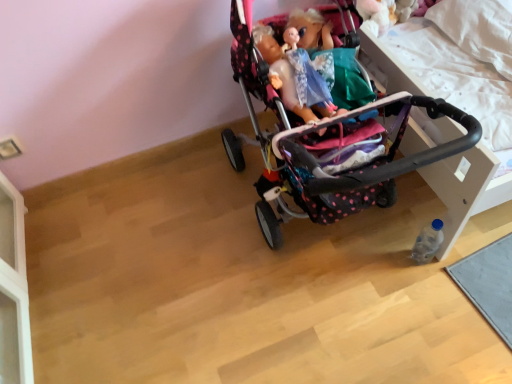
The image size is (512, 384). In order to click on free spot to the right of clear plastic bottle at lower right in this screenshot , I will do `click(474, 258)`.